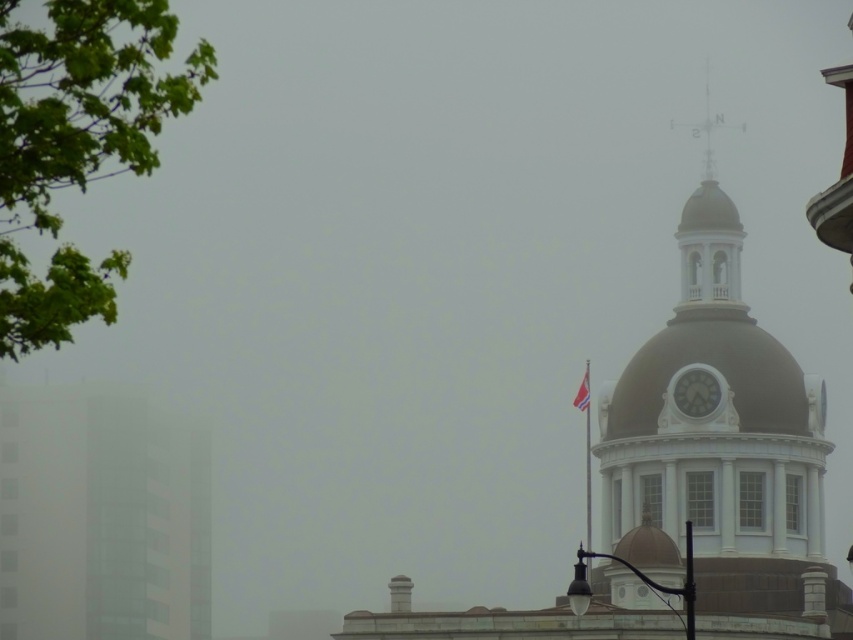
You are standing on the street looking at the building. There are two points marked on the building facade. The first point is at coordinates point (820,493) and the second is at point (705,376). Which point is closer to your view?

Point (820,493) is closer to your view because it is further to the viewer than point (705,376).

Consider the image. You are a tourist standing on the street looking at the white stone clock tower at upper right and the white glossy clock at upper right. Which one is closer to you?

The white stone clock tower at upper right is closer to you because it is in front of the white glossy clock at upper right.

You are standing on the street looking up at the building. Which object is positioned to the right of the other between the white glossy clock at upper right and the white fabric flag at upper center?

The white glossy clock at upper right is positioned to the right of the white fabric flag at upper center.